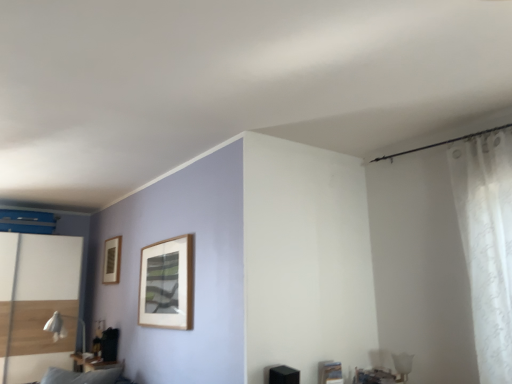
Question: Is white glossy screen door at left bigger than white sheer curtain at right?

Choices:
 (A) no
 (B) yes

Answer: (B)

Question: Is white glossy screen door at left facing away from white sheer curtain at right?

Choices:
 (A) no
 (B) yes

Answer: (A)

Question: From a real-world perspective, does white glossy screen door at left stand above white sheer curtain at right?

Choices:
 (A) yes
 (B) no

Answer: (B)

Question: Is white glossy screen door at left not inside white sheer curtain at right?

Choices:
 (A) yes
 (B) no

Answer: (A)

Question: Considering the relative sizes of white glossy screen door at left and white sheer curtain at right in the image provided, is white glossy screen door at left smaller than white sheer curtain at right?

Choices:
 (A) no
 (B) yes

Answer: (A)

Question: Considering the positions of point (116, 258) and point (501, 155), is point (116, 258) closer or farther from the camera than point (501, 155)?

Choices:
 (A) farther
 (B) closer

Answer: (A)

Question: Is wooden picture frame at upper left taller or shorter than white sheer curtain at right?

Choices:
 (A) tall
 (B) short

Answer: (B)

Question: In terms of size, does wooden picture frame at upper left appear bigger or smaller than white sheer curtain at right?

Choices:
 (A) small
 (B) big

Answer: (A)

Question: From a real-world perspective, is wooden picture frame at upper left positioned above or below white sheer curtain at right?

Choices:
 (A) above
 (B) below

Answer: (A)

Question: Relative to matte black table at lower left, is white sheer curtain at right in front or behind?

Choices:
 (A) front
 (B) behind

Answer: (A)

Question: In the image, is white sheer curtain at right on the left side or the right side of matte black table at lower left?

Choices:
 (A) right
 (B) left

Answer: (A)

Question: Does point (493, 296) appear closer or farther from the camera than point (88, 362)?

Choices:
 (A) farther
 (B) closer

Answer: (B)

Question: Do you think white sheer curtain at right is within matte black table at lower left, or outside of it?

Choices:
 (A) outside
 (B) inside

Answer: (A)

Question: In terms of width, does white glossy screen door at left look wider or thinner when compared to wooden picture frame at upper left?

Choices:
 (A) thin
 (B) wide

Answer: (B)

Question: Considering their positions, is white glossy screen door at left located in front of or behind wooden picture frame at upper left?

Choices:
 (A) behind
 (B) front

Answer: (B)